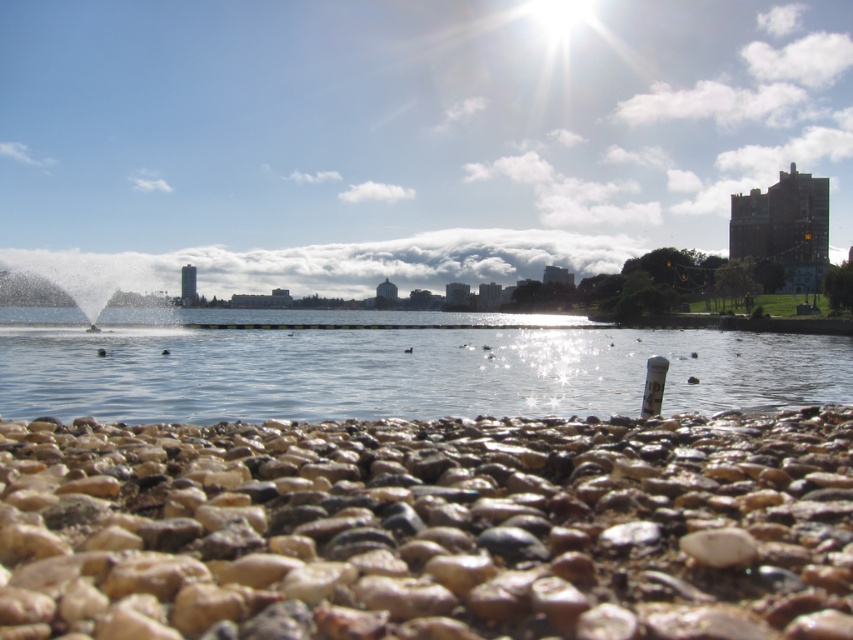
What do you see at coordinates (428, 529) in the screenshot? This screenshot has height=640, width=853. I see `brown pebbles at lower center` at bounding box center [428, 529].

Is point (769, 420) closer to viewer compared to point (741, 385)?

Yes, it is.

Does point (184, 568) lie in front of point (312, 384)?

That is True.

I want to click on brown pebbles at lower center, so click(x=428, y=529).